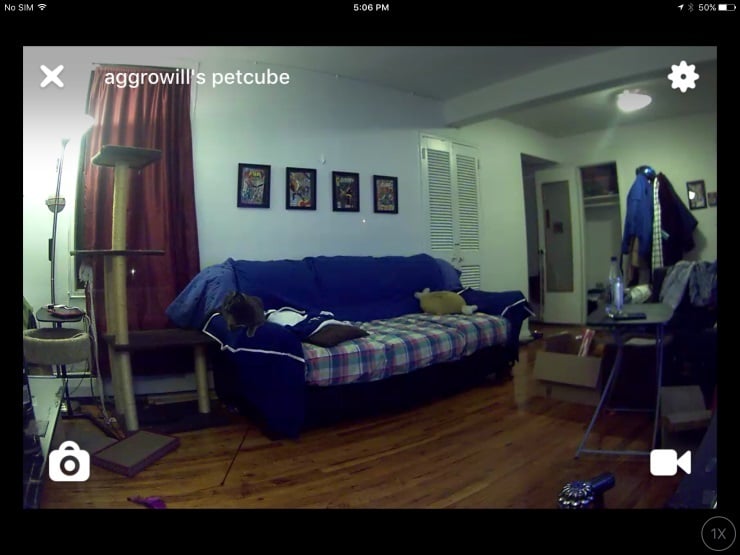
Locate an element on the screen. The height and width of the screenshot is (555, 740). coats on rack is located at coordinates (647, 225).